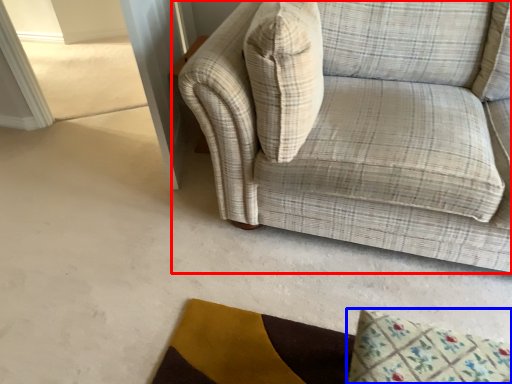
Question: Which object is closer to the camera taking this photo, studio couch (highlighted by a red box) or mat (highlighted by a blue box)?

Choices:
 (A) studio couch
 (B) mat

Answer: (A)